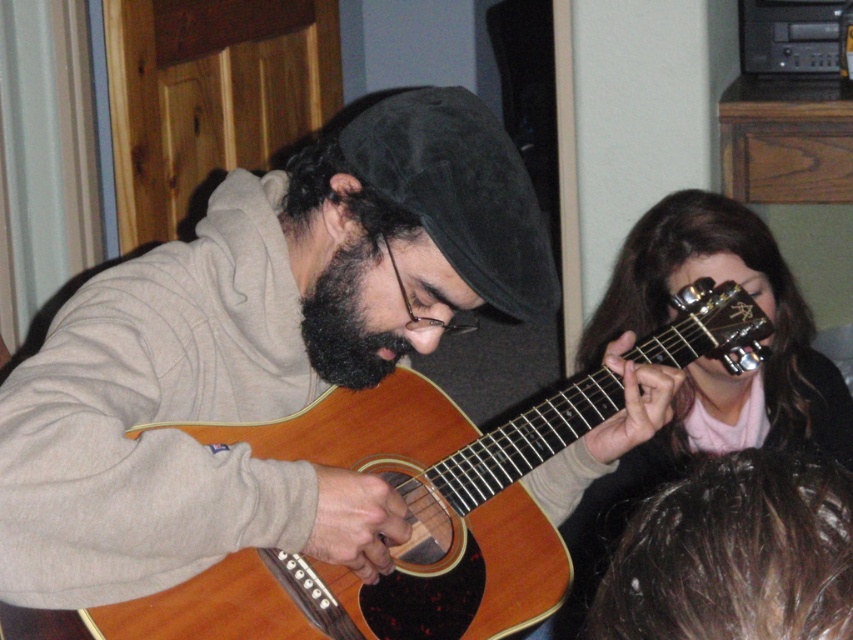
Question: Is matte black guitar at upper right thinner than dark brown fuzzy beard at center?

Choices:
 (A) no
 (B) yes

Answer: (A)

Question: Does wooden acoustic guitar at center appear over matte black guitar at upper right?

Choices:
 (A) yes
 (B) no

Answer: (A)

Question: Estimate the real-world distances between objects in this image. Which object is farther from the dark brown fuzzy beard at center?

Choices:
 (A) wooden acoustic guitar at center
 (B) matte black guitar at upper right

Answer: (B)

Question: Which point is farther from the camera taking this photo?

Choices:
 (A) (776, 250)
 (B) (712, 339)
 (C) (354, 368)

Answer: (A)

Question: Is matte black guitar at upper right closer to camera compared to dark brown fuzzy beard at center?

Choices:
 (A) no
 (B) yes

Answer: (A)

Question: Which point is farther to the camera?

Choices:
 (A) (392, 368)
 (B) (335, 412)

Answer: (B)